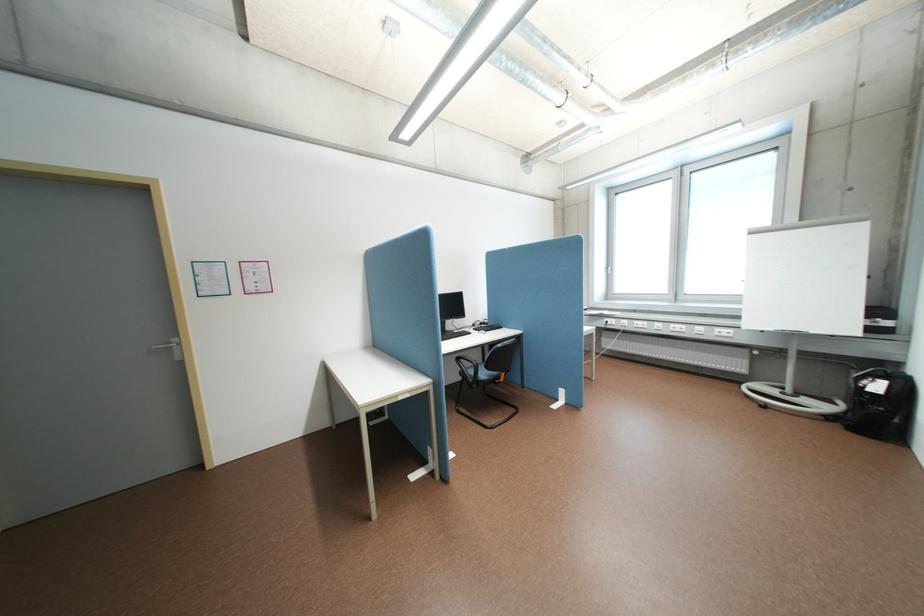
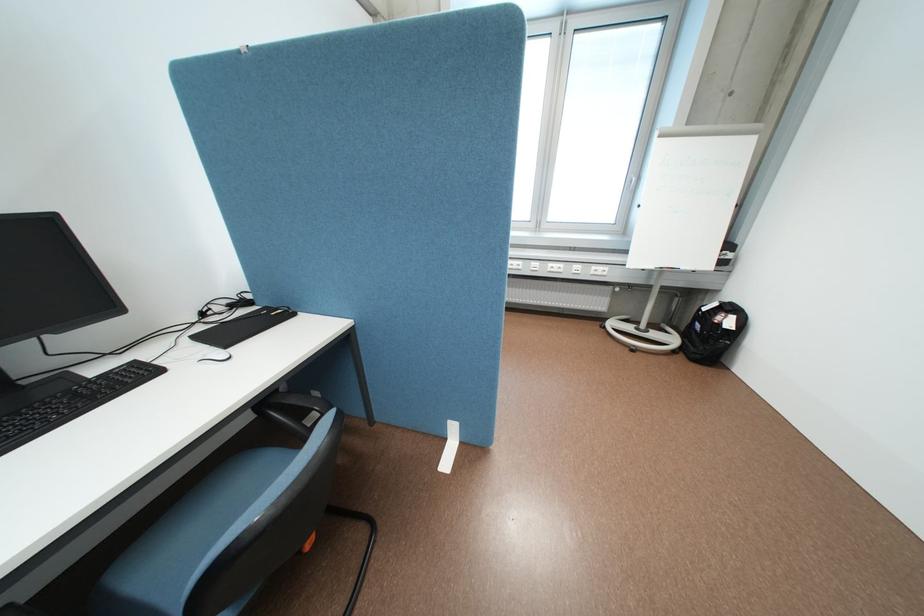
Locate, in the second image, the point that corresponds to pixel 728 329 in the first image.

(604, 267)